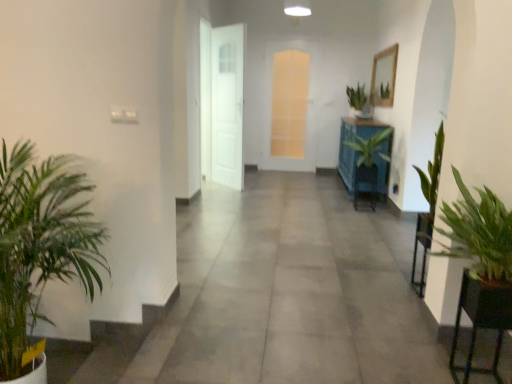
At what (x,y) coordinates should I click in order to perform the action: click on free point behind green leafy plant at right. Please return your answer as a coordinate pair (x, y). Image resolution: width=512 pixels, height=384 pixels. Looking at the image, I should click on (466, 354).